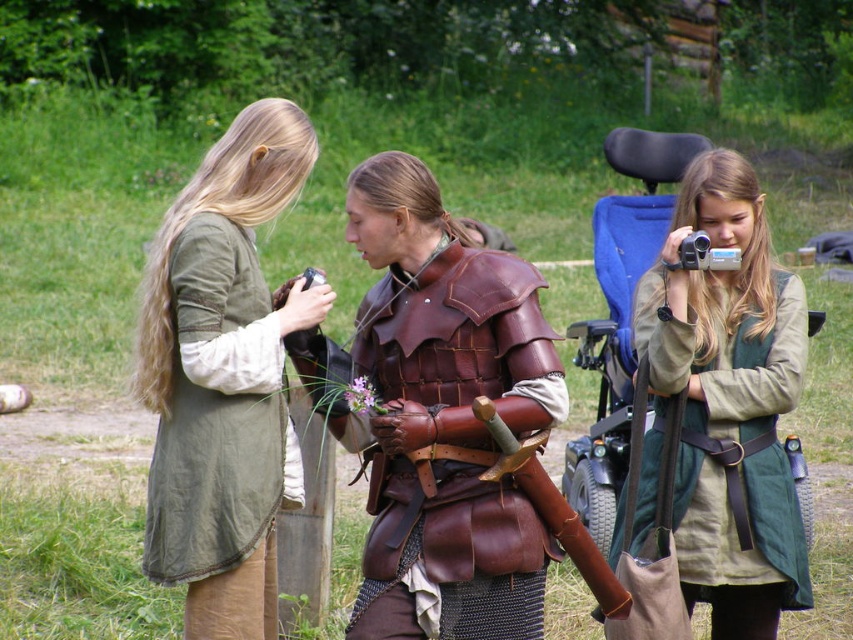
Between point (277, 326) and point (807, 339), which one is positioned behind?

Point (807, 339)

Between point (264, 458) and point (718, 435), which one is positioned in front?

Point (264, 458) is in front.

Locate an element on the screen. green linen tunic at left is located at coordinates (223, 378).

This screenshot has width=853, height=640. I want to click on green linen tunic at left, so point(223,378).

Is leather armor at center thinner than green canvas tunic at center?

Yes.

Which is above, leather armor at center or green canvas tunic at center?

leather armor at center

Does point (381, 548) come closer to viewer compared to point (709, 285)?

Yes, it is.

You are a GUI agent. You are given a task and a screenshot of the screen. Output one action in this format:
    pyautogui.click(x=<x>, y=<y>)
    Task: Click on the leather armor at center
    
    Given the screenshot: What is the action you would take?
    pyautogui.click(x=453, y=448)

Looking at this image, can you confirm if green linen tunic at left is taller than leather armor at center?

In fact, green linen tunic at left may be shorter than leather armor at center.

Which is in front, point (166, 445) or point (366, 332)?

Point (366, 332) is more forward.

Who is more forward, (x=273, y=477) or (x=444, y=396)?

Point (x=444, y=396) is in front.

Identify the location of green linen tunic at left. (223, 378).